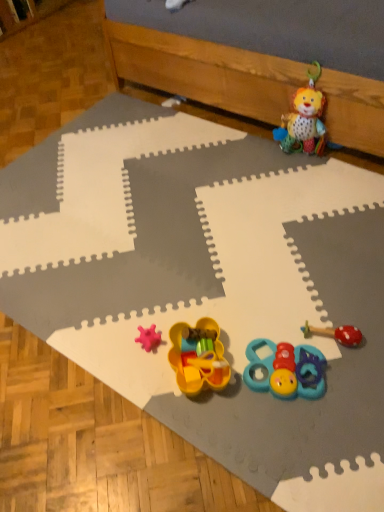
Where is `free point to the left of teal rubber teething toy at lower center, positioned as the second toy in front-to-back order`? The height and width of the screenshot is (512, 384). free point to the left of teal rubber teething toy at lower center, positioned as the second toy in front-to-back order is located at coordinates [217, 404].